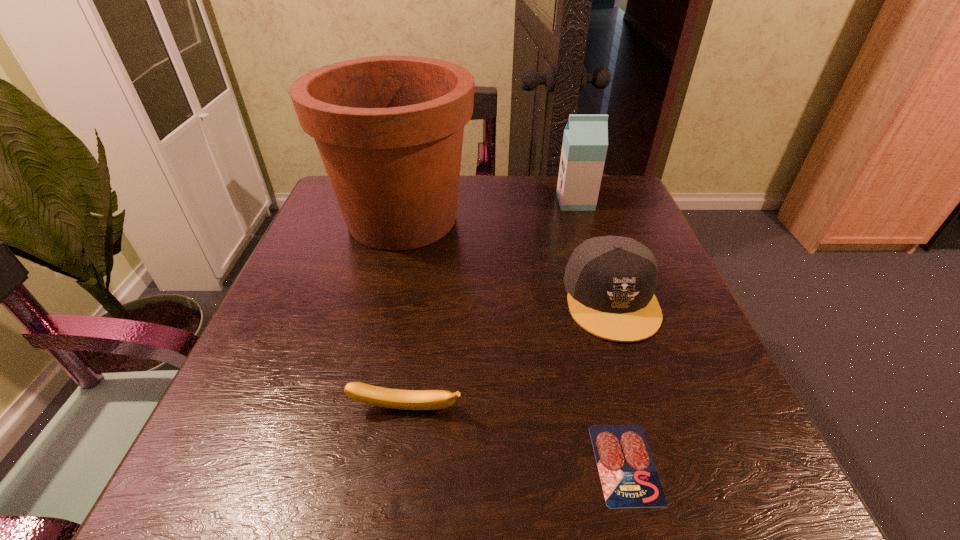
At what (x,y) coordinates should I click in order to perform the action: click on blank area located 0.070m at the stem of the banana. Please return your answer as a coordinate pair (x, y). Looking at the image, I should click on (397, 467).

This screenshot has width=960, height=540. Find the location of `free point located 0.270m on the back of the nearest object`. free point located 0.270m on the back of the nearest object is located at coordinates (583, 296).

Where is `flowerpot that is at the far edge`? flowerpot that is at the far edge is located at coordinates pyautogui.click(x=389, y=129).

Find the location of `milk carton that is at the far edge`. milk carton that is at the far edge is located at coordinates (585, 141).

At what (x,y) coordinates should I click in order to perform the action: click on object that is at the near edge. Please return your answer as a coordinate pair (x, y). This screenshot has width=960, height=540. Looking at the image, I should click on (629, 479).

Find the location of a particular element. This screenshot has width=960, height=540. object present at the left edge is located at coordinates (389, 129).

At what (x,y) coordinates should I click in order to perform the action: click on milk carton present at the right edge. Please return your answer as a coordinate pair (x, y). Looking at the image, I should click on (585, 141).

Where is `cap positioned at the right edge`? This screenshot has height=540, width=960. cap positioned at the right edge is located at coordinates (610, 280).

This screenshot has height=540, width=960. What are the coordinates of `salami located in the right edge section of the desktop` in the screenshot? It's located at (629, 479).

The image size is (960, 540). What are the coordinates of `object that is positioned at the far left corner` in the screenshot? It's located at (389, 129).